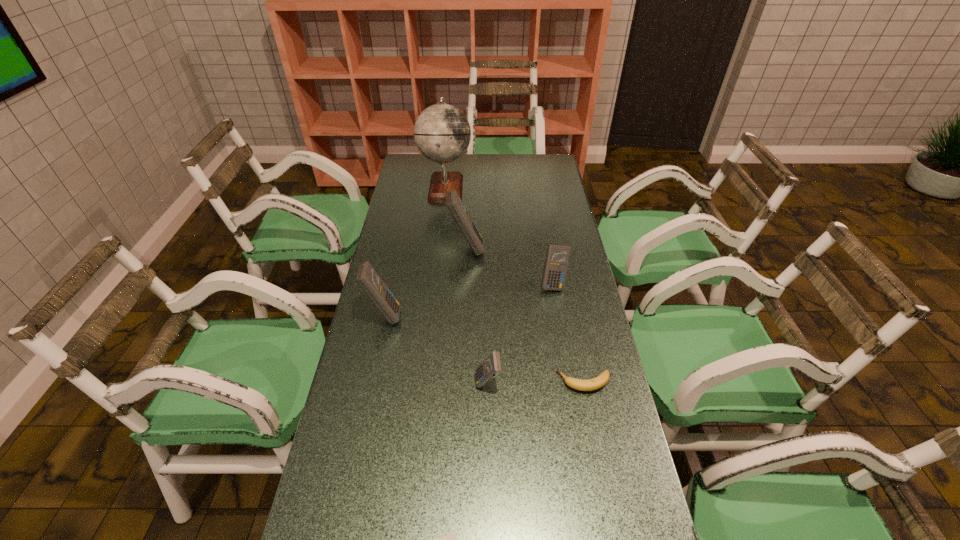
Find the location of a particular element. The height and width of the screenshot is (540, 960). vacant space at the far left corner of the desktop is located at coordinates (407, 158).

In the image, there is a desktop. Find the location of `vacant space at the far right corner`. vacant space at the far right corner is located at coordinates (534, 176).

Where is `free space between the rightmost blue calculator and the second shortest object`? free space between the rightmost blue calculator and the second shortest object is located at coordinates (568, 333).

The image size is (960, 540). What are the coordinates of `unoccupied area between the second farthest object and the rightmost blue calculator` in the screenshot? It's located at (510, 266).

I want to click on free space between the biggest blue calculator and the leftmost blue calculator, so click(425, 281).

Identify the location of vacant area that lies between the farthest blue calculator and the third farthest calculator. (425, 281).

You are a GUI agent. You are given a task and a screenshot of the screen. Output one action in this format:
    pyautogui.click(x=<x>, y=<y>)
    Task: Click on the free area in between the third nearest blue calculator and the second shortest object
    
    Given the screenshot: What is the action you would take?
    pyautogui.click(x=568, y=333)

Where is `vacant region between the smallest blue calculator and the sixth tallest object`? This screenshot has width=960, height=540. vacant region between the smallest blue calculator and the sixth tallest object is located at coordinates (536, 382).

Locate an element on the screen. This screenshot has height=540, width=960. free area in between the fourth nearest object and the farthest object is located at coordinates (415, 251).

Image resolution: width=960 pixels, height=540 pixels. I want to click on object that stands as the fifth closest to the tallest object, so click(596, 383).